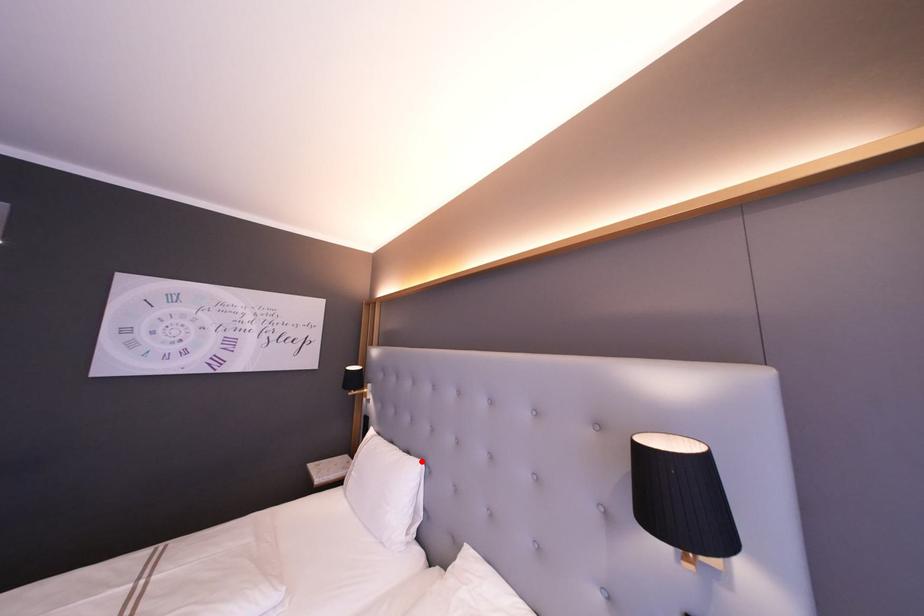
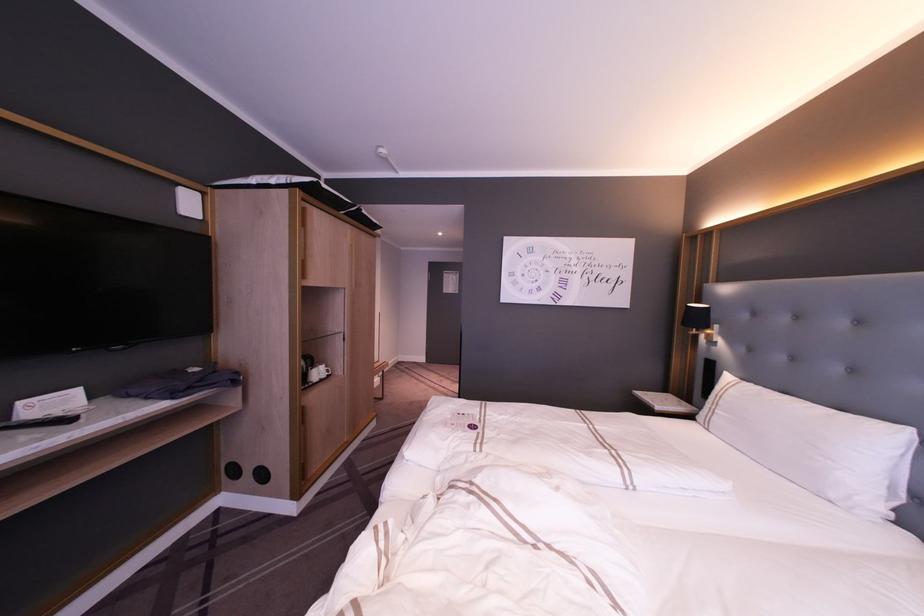
Question: I am providing you with two images of the same scene from different viewpoints. In image1, a red point is highlighted. Considering the same 3D point in image2, which of the following is correct?

Choices:
 (A) It is closer
 (B) It is farther

Answer: (A)